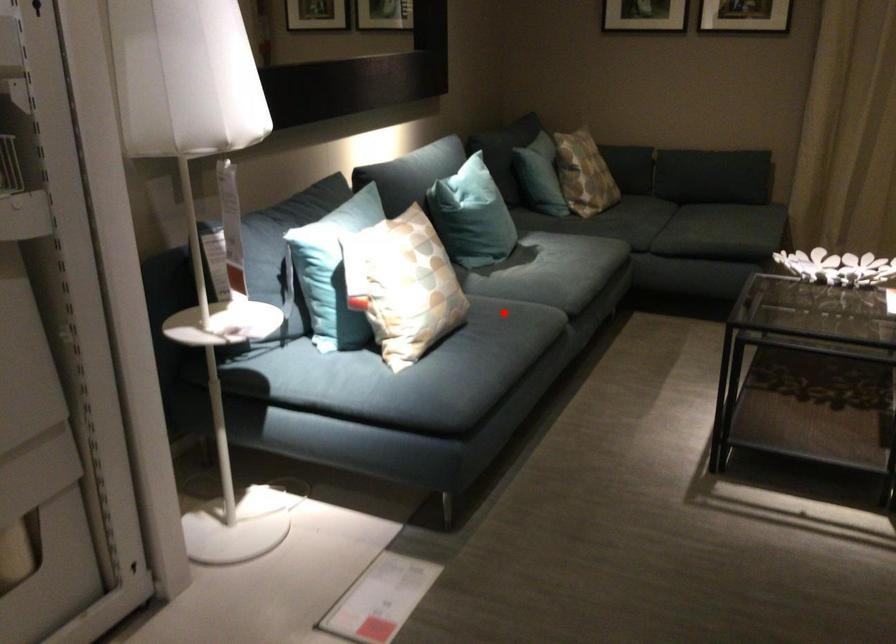
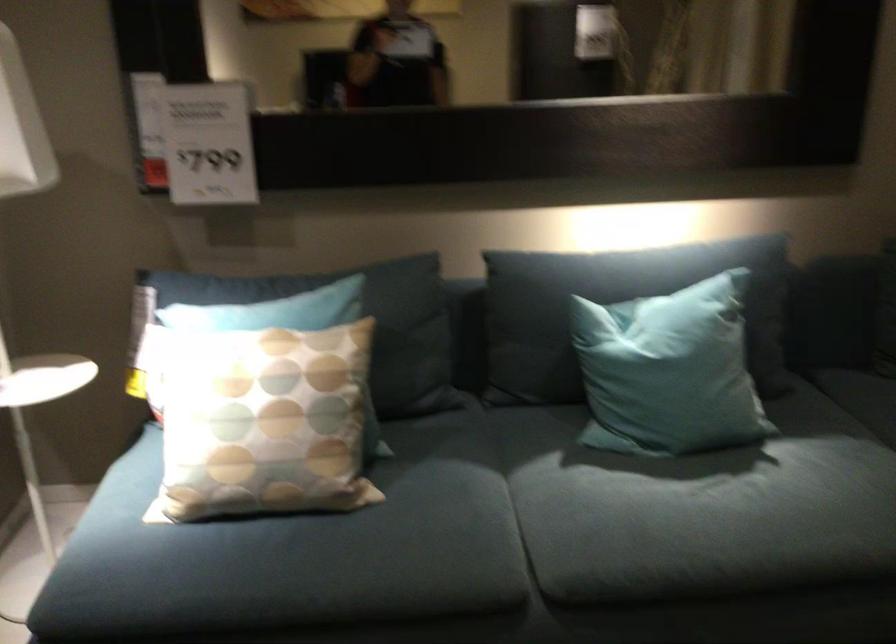
Question: I am providing you with two images of the same scene from different viewpoints. Given a red point in image1, look at the same physical point in image2. Is it:

Choices:
 (A) Closer to the viewpoint
 (B) Farther from the viewpoint

Answer: (A)